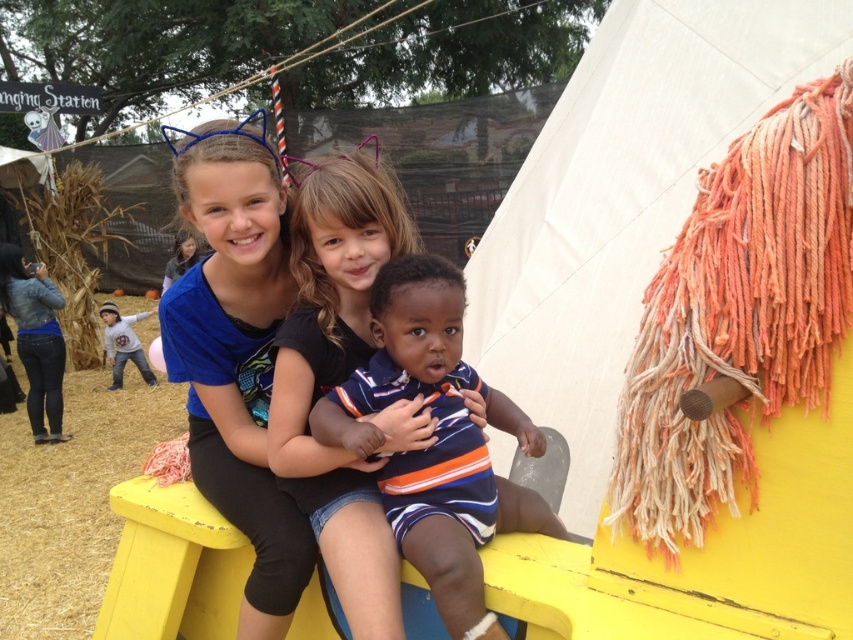
Question: Is blue fabric headband at upper center below striped cotton shirt at center?

Choices:
 (A) yes
 (B) no

Answer: (B)

Question: Which of these objects is positioned closest to the striped cotton shirt at center?

Choices:
 (A) matte black shirt at center
 (B) blue fabric headband at upper center

Answer: (A)

Question: Which of the following is the farthest from the observer?

Choices:
 (A) striped cotton shirt at center
 (B) blue fabric headband at upper center
 (C) matte black shirt at center

Answer: (B)

Question: Does blue fabric headband at upper center have a larger size compared to striped cotton shirt at center?

Choices:
 (A) yes
 (B) no

Answer: (A)

Question: Is blue fabric headband at upper center further to the viewer compared to matte black shirt at center?

Choices:
 (A) yes
 (B) no

Answer: (A)

Question: Estimate the real-world distances between objects in this image. Which object is farther from the blue fabric headband at upper center?

Choices:
 (A) matte black shirt at center
 (B) striped cotton shirt at center

Answer: (B)